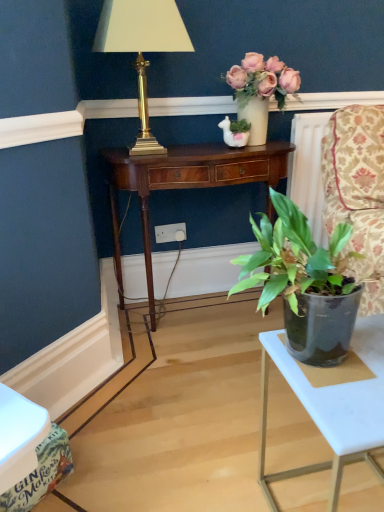
Question: Is mahogany wood desk at center outside of white plastic table at lower right?

Choices:
 (A) yes
 (B) no

Answer: (A)

Question: Can you confirm if mahogany wood desk at center is wider than white plastic table at lower right?

Choices:
 (A) yes
 (B) no

Answer: (B)

Question: From a real-world perspective, is mahogany wood desk at center under white plastic table at lower right?

Choices:
 (A) no
 (B) yes

Answer: (A)

Question: Is mahogany wood desk at center positioned behind white plastic table at lower right?

Choices:
 (A) yes
 (B) no

Answer: (A)

Question: Considering the relative sizes of mahogany wood desk at center and white plastic table at lower right in the image provided, is mahogany wood desk at center bigger than white plastic table at lower right?

Choices:
 (A) yes
 (B) no

Answer: (A)

Question: Considering the relative sizes of mahogany wood desk at center and white plastic table at lower right in the image provided, is mahogany wood desk at center shorter than white plastic table at lower right?

Choices:
 (A) yes
 (B) no

Answer: (B)

Question: Is gold metallic lamp at upper left positioned with its back to mahogany wood desk at center?

Choices:
 (A) no
 (B) yes

Answer: (A)

Question: Does gold metallic lamp at upper left have a larger size compared to mahogany wood desk at center?

Choices:
 (A) yes
 (B) no

Answer: (B)

Question: Is the position of gold metallic lamp at upper left less distant than that of mahogany wood desk at center?

Choices:
 (A) no
 (B) yes

Answer: (B)

Question: Is gold metallic lamp at upper left touching mahogany wood desk at center?

Choices:
 (A) no
 (B) yes

Answer: (A)

Question: Can you confirm if gold metallic lamp at upper left is positioned to the right of mahogany wood desk at center?

Choices:
 (A) yes
 (B) no

Answer: (B)

Question: From the image's perspective, is gold metallic lamp at upper left beneath mahogany wood desk at center?

Choices:
 (A) yes
 (B) no

Answer: (B)

Question: Does mahogany wood desk at center have a lesser height compared to white plastic power outlet at center?

Choices:
 (A) yes
 (B) no

Answer: (B)